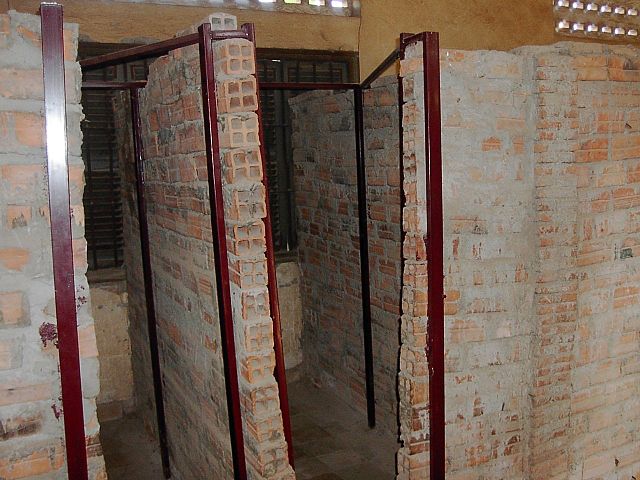
Find the location of a particular element. narrow walkway is located at coordinates (320, 295), (189, 295).